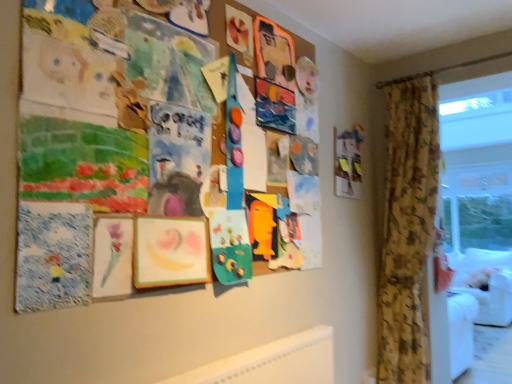
Question: Does wooden picture frame at upper right appear on the right side of transparent plastic window screen at right?

Choices:
 (A) no
 (B) yes

Answer: (A)

Question: From the image's perspective, is wooden picture frame at upper right below transparent plastic window screen at right?

Choices:
 (A) no
 (B) yes

Answer: (A)

Question: Considering the relative sizes of wooden picture frame at upper right and transparent plastic window screen at right in the image provided, is wooden picture frame at upper right thinner than transparent plastic window screen at right?

Choices:
 (A) yes
 (B) no

Answer: (A)

Question: Is wooden picture frame at upper right wider than transparent plastic window screen at right?

Choices:
 (A) no
 (B) yes

Answer: (A)

Question: Can transparent plastic window screen at right be found inside wooden picture frame at upper right?

Choices:
 (A) yes
 (B) no

Answer: (B)

Question: Considering the relative sizes of wooden picture frame at upper right and transparent plastic window screen at right in the image provided, is wooden picture frame at upper right smaller than transparent plastic window screen at right?

Choices:
 (A) yes
 (B) no

Answer: (A)

Question: Considering the relative sizes of floral fabric curtain at right and transparent plastic window screen at right in the image provided, is floral fabric curtain at right bigger than transparent plastic window screen at right?

Choices:
 (A) no
 (B) yes

Answer: (B)

Question: Is floral fabric curtain at right to the right of transparent plastic window screen at right from the viewer's perspective?

Choices:
 (A) no
 (B) yes

Answer: (A)

Question: From the image's perspective, is floral fabric curtain at right beneath transparent plastic window screen at right?

Choices:
 (A) no
 (B) yes

Answer: (B)

Question: Is floral fabric curtain at right surrounding transparent plastic window screen at right?

Choices:
 (A) yes
 (B) no

Answer: (B)

Question: Is floral fabric curtain at right next to transparent plastic window screen at right?

Choices:
 (A) yes
 (B) no

Answer: (B)

Question: Does floral fabric curtain at right have a smaller size compared to transparent plastic window screen at right?

Choices:
 (A) no
 (B) yes

Answer: (A)

Question: Can you confirm if transparent plastic window screen at right is taller than floral fabric curtain at right?

Choices:
 (A) no
 (B) yes

Answer: (A)